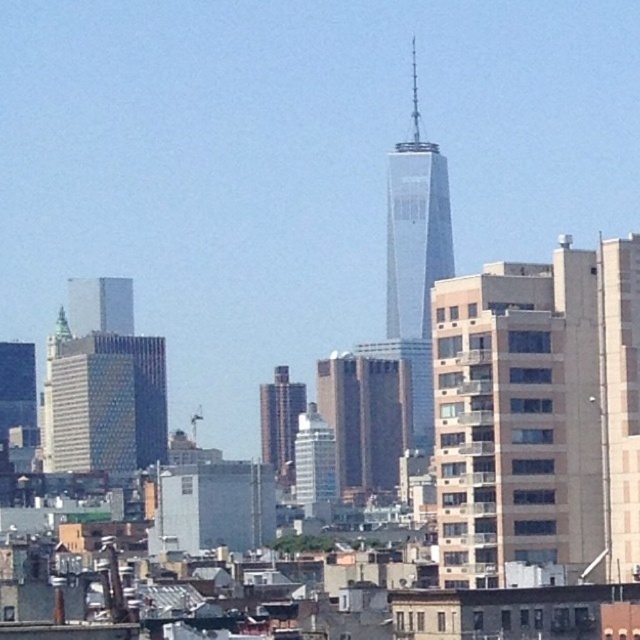
Question: Is white glossy building at center closer to camera compared to brick textured building at center?

Choices:
 (A) no
 (B) yes

Answer: (B)

Question: Which object appears closest to the camera in this image?

Choices:
 (A) brick textured building at center
 (B) beige concrete building at right

Answer: (B)

Question: Which object is farther from the camera taking this photo?

Choices:
 (A) smooth glass skyscraper at center
 (B) beige concrete building at right

Answer: (A)

Question: Among these points, which one is farthest from the camera?

Choices:
 (A) (304, 483)
 (B) (52, 412)
 (C) (627, 280)

Answer: (B)

Question: Is beige concrete building at right to the left of smooth glass skyscraper at center from the viewer's perspective?

Choices:
 (A) no
 (B) yes

Answer: (A)

Question: Does beige concrete building at right come behind white glossy building at center?

Choices:
 (A) no
 (B) yes

Answer: (A)